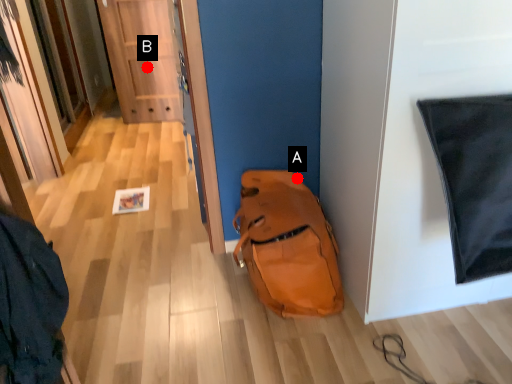
Question: Two points are circled on the image, labeled by A and B beside each circle. Which point is further to the camera?

Choices:
 (A) A is further
 (B) B is further

Answer: (B)